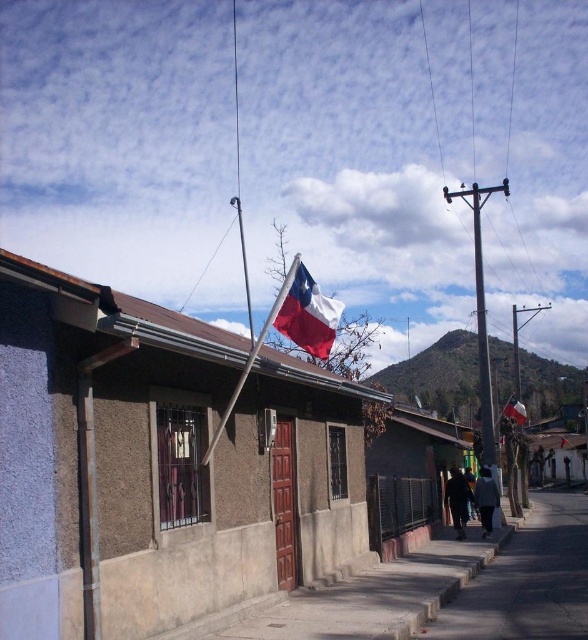
Question: Is polished fabric flag at center below metallic pole at center-right?

Choices:
 (A) yes
 (B) no

Answer: (A)

Question: Is concrete sidewalk at lower center bigger than polished fabric flag at center?

Choices:
 (A) no
 (B) yes

Answer: (B)

Question: Among these objects, which one is nearest to the camera?

Choices:
 (A) polished wood flag at center
 (B) metallic pole at center-right

Answer: (B)

Question: Which of the following is the closest to the observer?

Choices:
 (A) wooden flag pole at upper center
 (B) concrete sidewalk at lower center
 (C) polished wood flag at center
 (D) polished fabric flag at center

Answer: (A)

Question: Can you confirm if metallic pole at center-right is thinner than polished wood flag at center?

Choices:
 (A) no
 (B) yes

Answer: (A)

Question: Among these objects, which one is farthest from the camera?

Choices:
 (A) metallic pole at center-right
 (B) polished wood flag at center
 (C) polished fabric flag at center

Answer: (B)